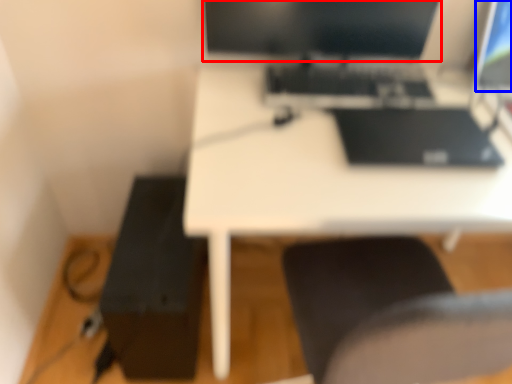
Question: Which object is further to the camera taking this photo, computer monitor (highlighted by a red box) or computer screen (highlighted by a blue box)?

Choices:
 (A) computer monitor
 (B) computer screen

Answer: (B)